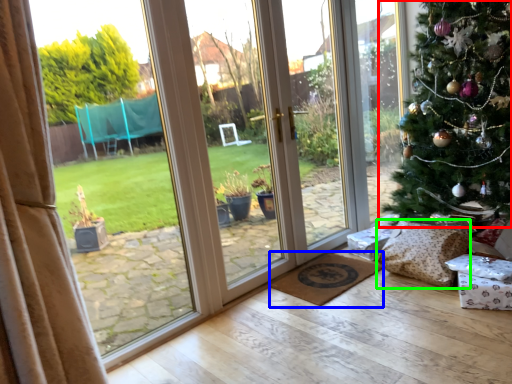
Question: Estimate the real-world distances between objects in this image. Which object is farther from christmas tree (highlighted by a red box), doormat (highlighted by a blue box) or pillow (highlighted by a green box)?

Choices:
 (A) doormat
 (B) pillow

Answer: (A)